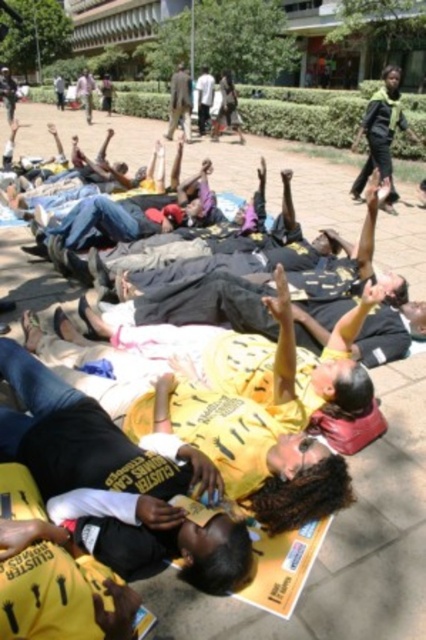
You are a photographer at the protest scene. You need to capture a photo that includes both the green fabric scarf at upper right and the dark brown suit at center. Which object should you position closer to the right side of the frame to ensure both are visible?

The green fabric scarf at upper right should be positioned closer to the right side of the frame since it is already to the right of the dark brown suit at center.

You are organizing a protest and need to decide which item to use as a banner. The green fabric scarf at upper right and the dark brown suit at center are available. Which item is wider and better suited for displaying a message?

The green fabric scarf at upper right is wider than the dark brown suit at center, making it better suited for displaying a message.

You are a photographer trying to capture the protest scene. You want to include the green fabric scarf at upper right in your shot. Where should you position your camera to ensure it is visible in the frame?

Position your camera so that it captures the upper right area of the scene, specifically targeting the coordinates point at (382, 134) where the green fabric scarf at upper right is located.